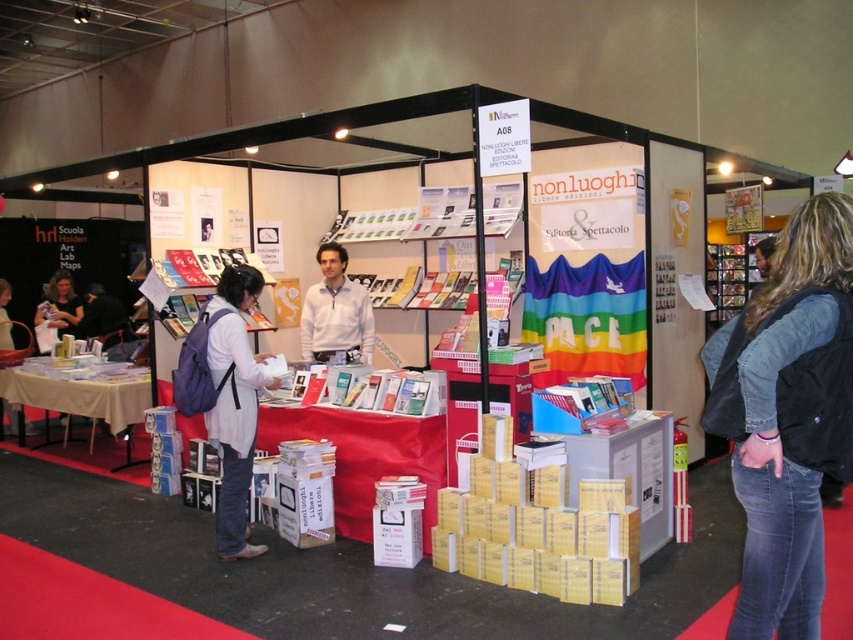
Question: Which point appears closest to the camera in this image?

Choices:
 (A) (322, 244)
 (B) (834, 310)
 (C) (74, 314)

Answer: (B)

Question: Where is white cotton backpack at center located in relation to matte white sweater at lower left in the image?

Choices:
 (A) above
 (B) below

Answer: (B)

Question: Which object appears closest to the camera in this image?

Choices:
 (A) matte white sweater at lower left
 (B) denim jacket at lower right

Answer: (B)

Question: Which of the following is the farthest from the observer?

Choices:
 (A) (312, 285)
 (B) (782, 493)
 (C) (3, 348)

Answer: (C)

Question: Does white cotton backpack at center appear on the left side of matte white sweater at lower left?

Choices:
 (A) yes
 (B) no

Answer: (B)

Question: Can you confirm if white cotton backpack at center is positioned above matte gray sweater at center?

Choices:
 (A) yes
 (B) no

Answer: (B)